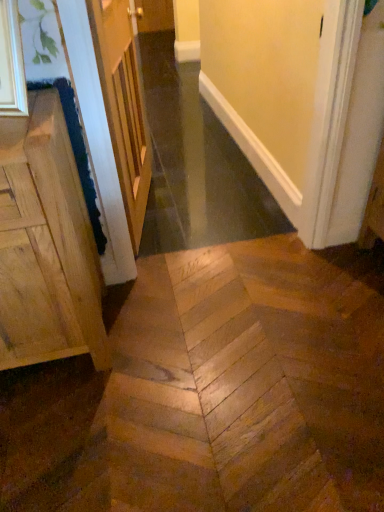
Describe the element at coordinates (46, 245) in the screenshot. I see `natural wood cabinet at left` at that location.

Where is `natural wood cabinet at left`? The image size is (384, 512). natural wood cabinet at left is located at coordinates (46, 245).

Where is `wooden door at upper left`? This screenshot has height=512, width=384. wooden door at upper left is located at coordinates (123, 106).

The image size is (384, 512). Describe the element at coordinates (123, 106) in the screenshot. I see `wooden door at upper left` at that location.

Locate an element on the screen. The image size is (384, 512). natural wood cabinet at left is located at coordinates (46, 245).

Which is more to the left, wooden door at upper left or natural wood cabinet at left?

From the viewer's perspective, natural wood cabinet at left appears more on the left side.

Considering their positions, is wooden door at upper left located in front of or behind natural wood cabinet at left?

wooden door at upper left is behind natural wood cabinet at left.

Is point (120, 0) closer to camera compared to point (86, 268)?

That is False.

From the image's perspective, is wooden door at upper left over natural wood cabinet at left?

Yes.

From a real-world perspective, between wooden door at upper left and natural wood cabinet at left, who is vertically lower?

In real-world perspective, natural wood cabinet at left is lower.

From the picture: In terms of width, does wooden door at upper left look wider or thinner when compared to natural wood cabinet at left?

In the image, wooden door at upper left appears to be more narrow than natural wood cabinet at left.

Considering the sizes of objects wooden door at upper left and natural wood cabinet at left in the image provided, who is shorter, wooden door at upper left or natural wood cabinet at left?

With less height is natural wood cabinet at left.

Between wooden door at upper left and natural wood cabinet at left, which one has smaller size?

wooden door at upper left.

Do you think wooden door at upper left is within natural wood cabinet at left, or outside of it?

wooden door at upper left is outside natural wood cabinet at left.

Is wooden door at upper left far away from natural wood cabinet at left?

No, wooden door at upper left is not far away from natural wood cabinet at left.

Is wooden door at upper left facing towards natural wood cabinet at left?

No, wooden door at upper left is not turned towards natural wood cabinet at left.

Locate an element on the screen. This screenshot has height=512, width=384. door above the natural wood cabinet at left (from the image's perspective) is located at coordinates (123, 106).

Which is more to the left, natural wood cabinet at left or wooden door at upper left?

Positioned to the left is natural wood cabinet at left.

Is natural wood cabinet at left closer to camera compared to wooden door at upper left?

Yes, it is in front of wooden door at upper left.

Is point (64, 122) closer to camera compared to point (144, 179)?

Yes, it is in front of point (144, 179).

From the picture: From the image's perspective, is natural wood cabinet at left above wooden door at upper left?

Incorrect, from the image's perspective, natural wood cabinet at left is lower than wooden door at upper left.

From a real-world perspective, which object stands above the other?

wooden door at upper left.

Considering the sizes of natural wood cabinet at left and wooden door at upper left in the image, is natural wood cabinet at left wider or thinner than wooden door at upper left?

Considering their sizes, natural wood cabinet at left looks broader than wooden door at upper left.

Who is taller, natural wood cabinet at left or wooden door at upper left?

wooden door at upper left.

Considering the relative sizes of natural wood cabinet at left and wooden door at upper left in the image provided, is natural wood cabinet at left bigger than wooden door at upper left?

Yes.

In the scene shown: Is natural wood cabinet at left completely or partially outside of wooden door at upper left?

Absolutely, natural wood cabinet at left is external to wooden door at upper left.

Are natural wood cabinet at left and wooden door at upper left making contact?

No, natural wood cabinet at left is not making contact with wooden door at upper left.

Is natural wood cabinet at left facing towards wooden door at upper left?

No, natural wood cabinet at left does not turn towards wooden door at upper left.

How much distance is there between natural wood cabinet at left and wooden door at upper left?

They are 62.31 centimeters apart.

Locate an element on the screen. Image resolution: width=384 pixels, height=512 pixels. cabinetry below the wooden door at upper left (from the image's perspective) is located at coordinates click(46, 245).

I want to click on cabinetry on the left side of wooden door at upper left, so click(46, 245).

In order to click on cabinetry that appears in front of the wooden door at upper left in this screenshot , I will do `click(46, 245)`.